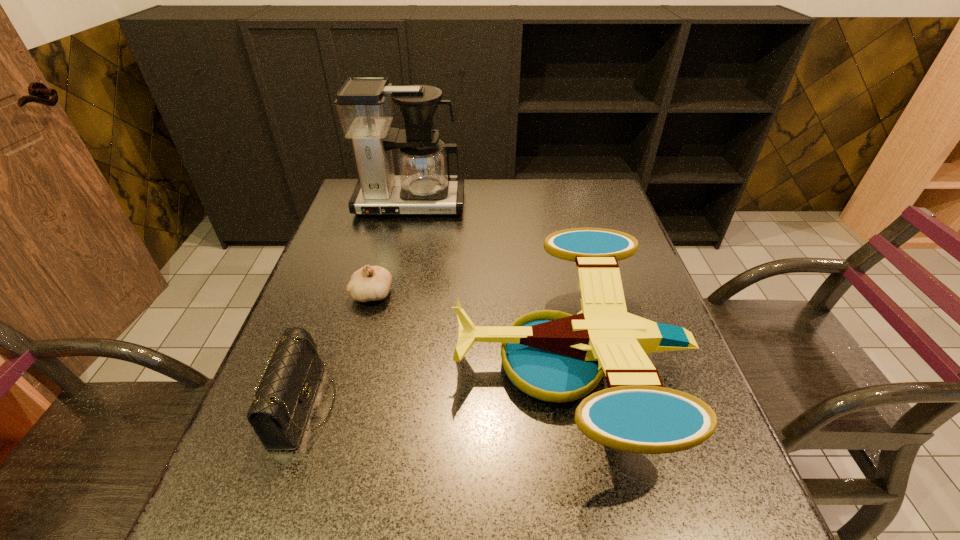
Where is `the third closest object to the second tallest object`? the third closest object to the second tallest object is located at coordinates (424, 185).

Find the location of a particular element. Image resolution: width=960 pixels, height=540 pixels. free location that satisfies the following two spatial constraints: 1. on the front side of the shortest object; 2. on the front flap of the clutch bag is located at coordinates (342, 405).